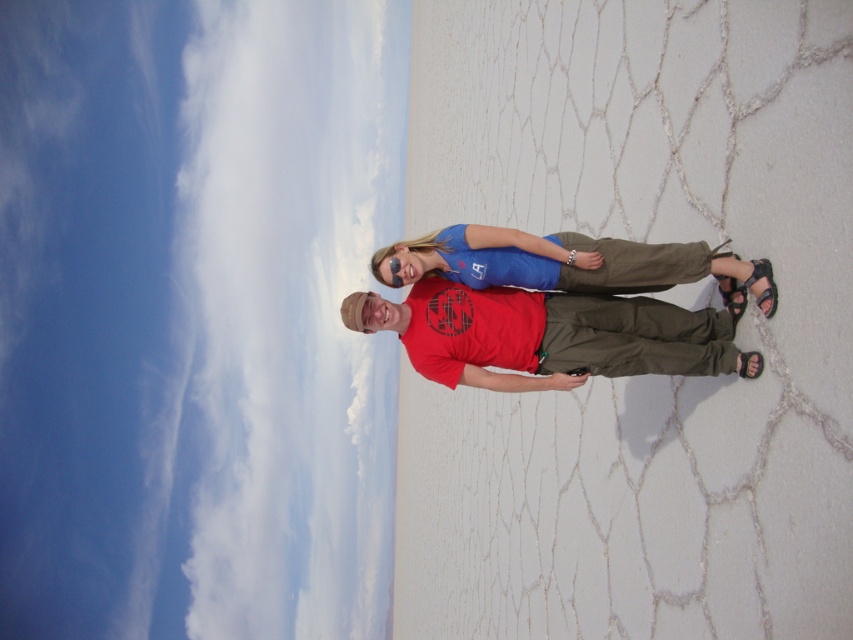
Does matte red t-shirt at center have a lesser height compared to black synthetic sandal at lower right?

No, matte red t-shirt at center is not shorter than black synthetic sandal at lower right.

Measure the distance from matte red t-shirt at center to black synthetic sandal at lower right.

They are 36.76 inches apart.

You are a GUI agent. You are given a task and a screenshot of the screen. Output one action in this format:
    pyautogui.click(x=<x>, y=<y>)
    Task: Click on the matte red t-shirt at center
    
    Given the screenshot: What is the action you would take?
    pyautogui.click(x=550, y=307)

Between matte red t-shirt at center and black leather sandal at lower right, which one appears on the right side from the viewer's perspective?

From the viewer's perspective, black leather sandal at lower right appears more on the right side.

Is matte red t-shirt at center above black leather sandal at lower right?

Actually, matte red t-shirt at center is below black leather sandal at lower right.

Is point (434, 253) farther from viewer compared to point (759, 296)?

Yes, it is.

At what (x,y) coordinates should I click in order to perform the action: click on matte red t-shirt at center. Please return your answer as a coordinate pair (x, y). Looking at the image, I should click on (550, 307).

In the scene shown: Can you confirm if black leather sandal at lower right is positioned above black synthetic sandal at lower right?

Indeed, black leather sandal at lower right is positioned over black synthetic sandal at lower right.

Which is behind, point (743, 284) or point (749, 362)?

Point (743, 284)

Who is more distant from viewer, (766,312) or (751,356)?

Point (751,356)

The width and height of the screenshot is (853, 640). I want to click on black leather sandal at lower right, so click(x=764, y=285).